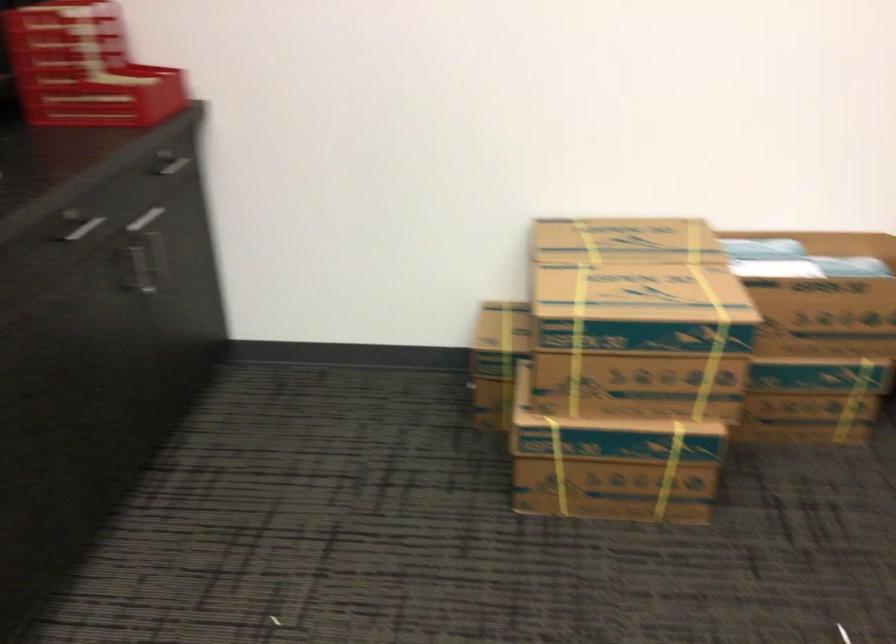
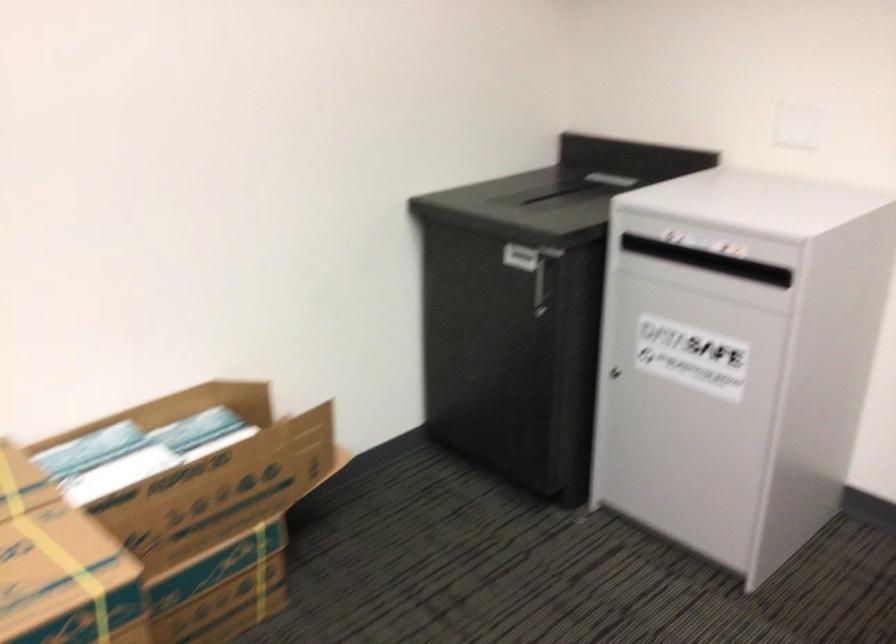
Where in the second image is the point corresponding to the point at 781,256 from the first image?

(136, 451)